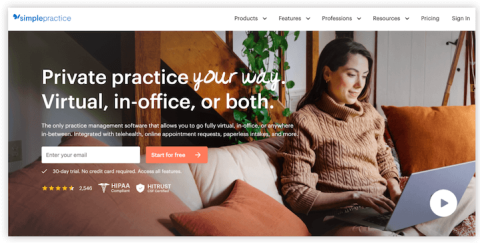
Where is `cream colored couch cushion`? The height and width of the screenshot is (243, 480). cream colored couch cushion is located at coordinates (219, 177).